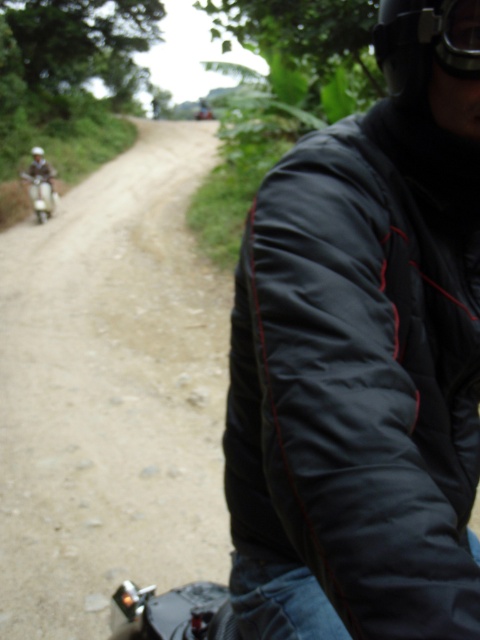
Question: Which object is farther from the camera taking this photo?

Choices:
 (A) black matte helmet at upper right
 (B) dusty gravel road at center
 (C) black matte goggles at upper right

Answer: (B)

Question: Is dusty gravel road at center to the right of black matte goggles at upper right from the viewer's perspective?

Choices:
 (A) yes
 (B) no

Answer: (B)

Question: Which point appears farthest from the camera in this image?

Choices:
 (A) (35, 173)
 (B) (447, 20)
 (C) (472, 45)
 (D) (356, 392)

Answer: (A)

Question: Which object is farther from the camera taking this photo?

Choices:
 (A) dusty gravel road at center
 (B) black puffy jacket at right
 (C) matte white scooter at left

Answer: (C)

Question: Can you confirm if black puffy jacket at right is positioned above black matte goggles at upper right?

Choices:
 (A) no
 (B) yes

Answer: (A)

Question: Does black matte helmet at upper right appear on the left side of matte white scooter at left?

Choices:
 (A) yes
 (B) no

Answer: (B)